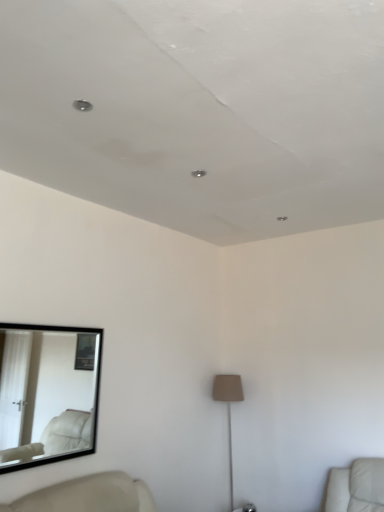
Question: Should I look upward or downward to see black framed mirror at left?

Choices:
 (A) up
 (B) down

Answer: (B)

Question: Considering the relative sizes of black framed mirror at left and beige fabric lamp at center in the image provided, is black framed mirror at left wider than beige fabric lamp at center?

Choices:
 (A) no
 (B) yes

Answer: (A)

Question: Considering the relative positions of black framed mirror at left and beige fabric lamp at center in the image provided, is black framed mirror at left behind beige fabric lamp at center?

Choices:
 (A) yes
 (B) no

Answer: (B)

Question: From the image's perspective, is black framed mirror at left beneath beige fabric lamp at center?

Choices:
 (A) no
 (B) yes

Answer: (A)

Question: Does black framed mirror at left have a smaller size compared to beige fabric lamp at center?

Choices:
 (A) yes
 (B) no

Answer: (A)

Question: Is black framed mirror at left taller than beige fabric lamp at center?

Choices:
 (A) yes
 (B) no

Answer: (B)

Question: Is black framed mirror at left surrounding beige fabric lamp at center?

Choices:
 (A) yes
 (B) no

Answer: (B)

Question: Is beige fabric lamp at center positioned with its back to black framed mirror at left?

Choices:
 (A) no
 (B) yes

Answer: (A)

Question: Considering the relative sizes of beige fabric lamp at center and black framed mirror at left in the image provided, is beige fabric lamp at center bigger than black framed mirror at left?

Choices:
 (A) no
 (B) yes

Answer: (B)

Question: From the image's perspective, would you say beige fabric lamp at center is positioned over black framed mirror at left?

Choices:
 (A) no
 (B) yes

Answer: (A)

Question: Can you see beige fabric lamp at center touching black framed mirror at left?

Choices:
 (A) no
 (B) yes

Answer: (A)

Question: Is beige fabric lamp at center to the right of black framed mirror at left from the viewer's perspective?

Choices:
 (A) no
 (B) yes

Answer: (B)

Question: Is beige fabric lamp at center far from black framed mirror at left?

Choices:
 (A) yes
 (B) no

Answer: (A)

Question: Is black framed mirror at left taller or shorter than beige fabric lamp at center?

Choices:
 (A) tall
 (B) short

Answer: (B)